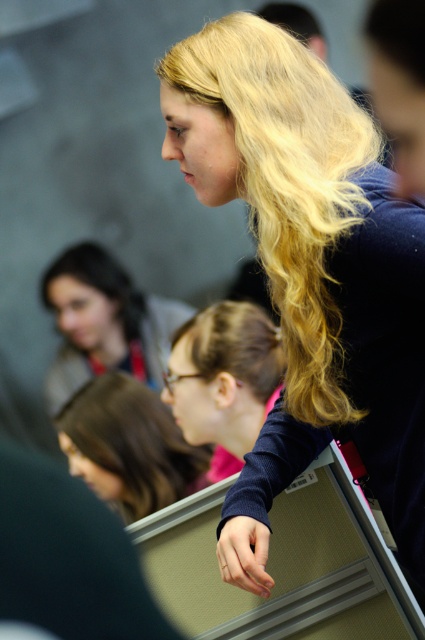
Question: Which point is closer to the camera?

Choices:
 (A) blonde silky hair at upper center
 (B) brown smooth hair at center
 (C) matte black hair at lower center
 (D) blonde hair at lower left

Answer: (A)

Question: Which is nearer to the blonde hair at lower left?

Choices:
 (A) blonde silky hair at upper center
 (B) brown smooth hair at center
 (C) matte black hair at lower center

Answer: (C)

Question: Where is blonde silky hair at upper center located in relation to brown smooth hair at center in the image?

Choices:
 (A) below
 (B) above

Answer: (B)

Question: Is brown smooth hair at center above blonde hair at lower left?

Choices:
 (A) yes
 (B) no

Answer: (B)

Question: Which point is farther from the camera taking this photo?

Choices:
 (A) (152, 435)
 (B) (269, 387)
 (C) (104, 340)
 (D) (53, 272)

Answer: (D)

Question: Is blonde silky hair at upper center smaller than blonde silky hair at center?

Choices:
 (A) no
 (B) yes

Answer: (A)